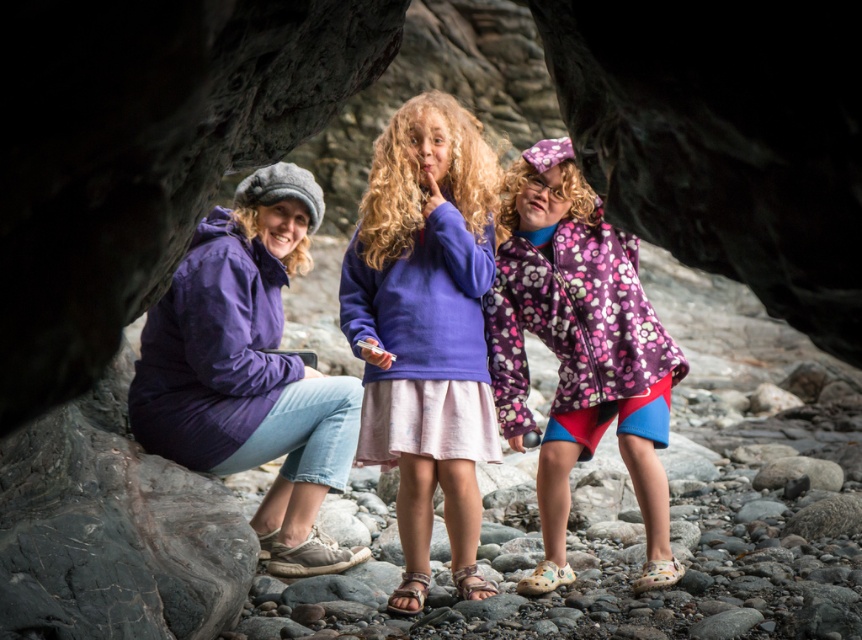
Looking at this image, you are standing at the entrance of the rocky tunnel and want to place two markers at the specified coordinates. The first marker is at point (473,326) and the second at point (646,586). Which marker will be closer to the tunnel entrance?

Point (646,586) is closer to the tunnel entrance because point (473,326) is behind it.

You are a photographer trying to capture a group photo of the purple fleece jacket at center and the floral fleece jacket at center. Which jacket will you need to move closer to the camera to ensure both fit in the frame?

The purple fleece jacket at center occupies less space than the floral fleece jacket at center, so you should move the purple fleece jacket at center closer to the camera to balance their sizes in the frame.